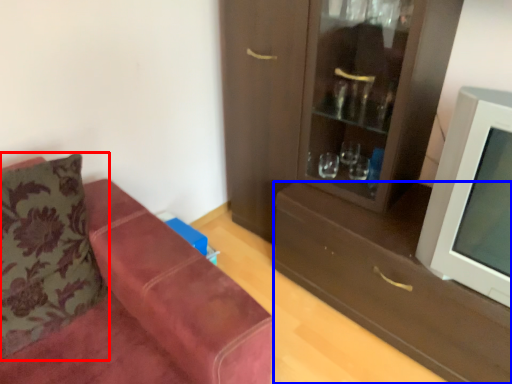
Question: Which object is further to the camera taking this photo, pillow (highlighted by a red box) or drawer (highlighted by a blue box)?

Choices:
 (A) pillow
 (B) drawer

Answer: (B)